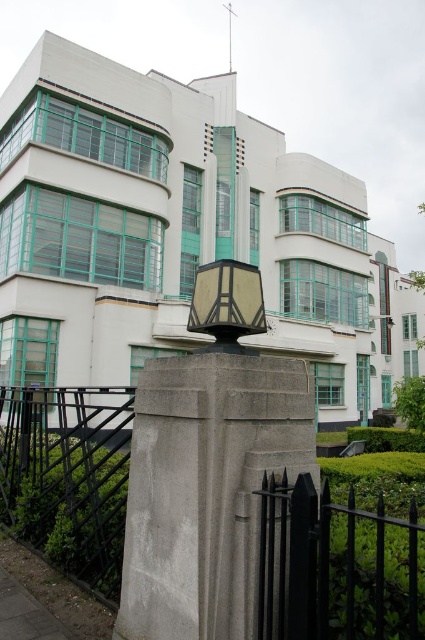
You are standing in front of the Art Deco building and want to take a photo. There are two points marked in the image. The first point is at coordinate point (87, 480) and the second is at point (204, 298). Which point is closer to your camera lens?

Point (87, 480) is further to the camera than point (204, 298), so the second point is closer to your camera lens.

You are standing in front of the Art Deco building and want to walk from the green leafy hedge at lower left to the matte beige lamp at center. Which direction should you move to reach the lamp?

You should move to the right to reach the matte beige lamp at center because the green leafy hedge at lower left is located to the left of the matte beige lamp at center.